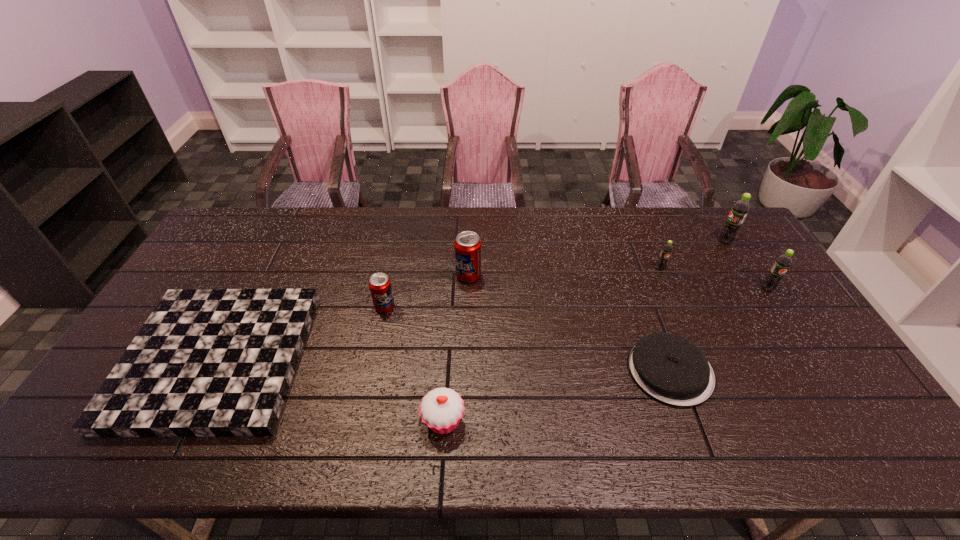
Locate an element on the screen. vacant position in the image that satisfies the following two spatial constraints: 1. on the front label of the farthest soda; 2. on the front label of the third soda from left to right is located at coordinates (742, 269).